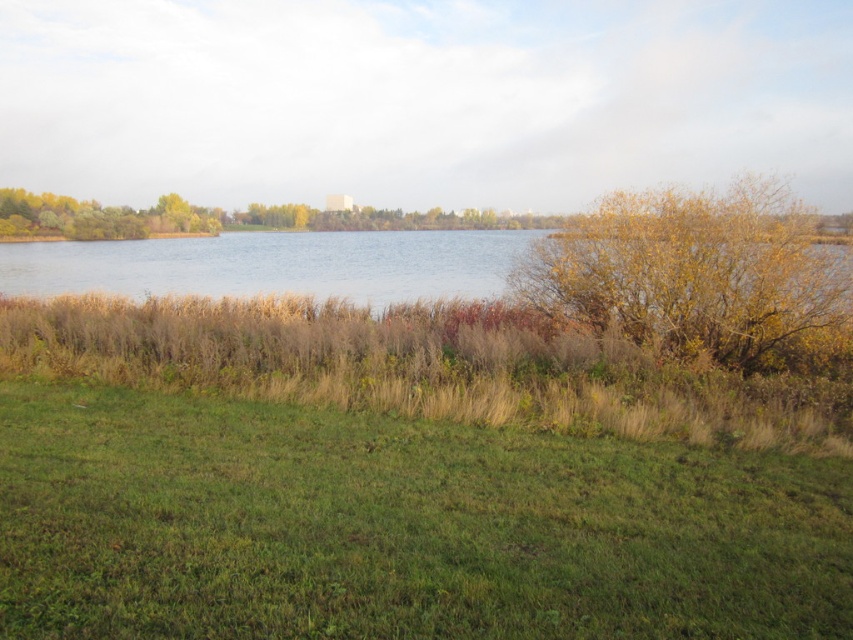
Which of these two, green grassy at lower center or yellow leafy bush at upper right, stands taller?

yellow leafy bush at upper right

The height and width of the screenshot is (640, 853). What do you see at coordinates (398, 528) in the screenshot?
I see `green grassy at lower center` at bounding box center [398, 528].

Is point (380, 621) positioned after point (819, 356)?

No, it is in front of (819, 356).

This screenshot has width=853, height=640. In order to click on green grassy at lower center in this screenshot , I will do `click(398, 528)`.

What do you see at coordinates (398, 528) in the screenshot? Image resolution: width=853 pixels, height=640 pixels. I see `green grassy at lower center` at bounding box center [398, 528].

Which is behind, point (848, 572) or point (10, 227)?

The point (10, 227) is more distant.

This screenshot has height=640, width=853. I want to click on green grassy at lower center, so click(398, 528).

Is brown grassy lake at center shorter than yellow autumn leaves at center?

Indeed, brown grassy lake at center has a lesser height compared to yellow autumn leaves at center.

Is brown grassy lake at center behind yellow autumn leaves at center?

No, brown grassy lake at center is in front of yellow autumn leaves at center.

Locate an element on the screen. Image resolution: width=853 pixels, height=640 pixels. brown grassy lake at center is located at coordinates (x=273, y=266).